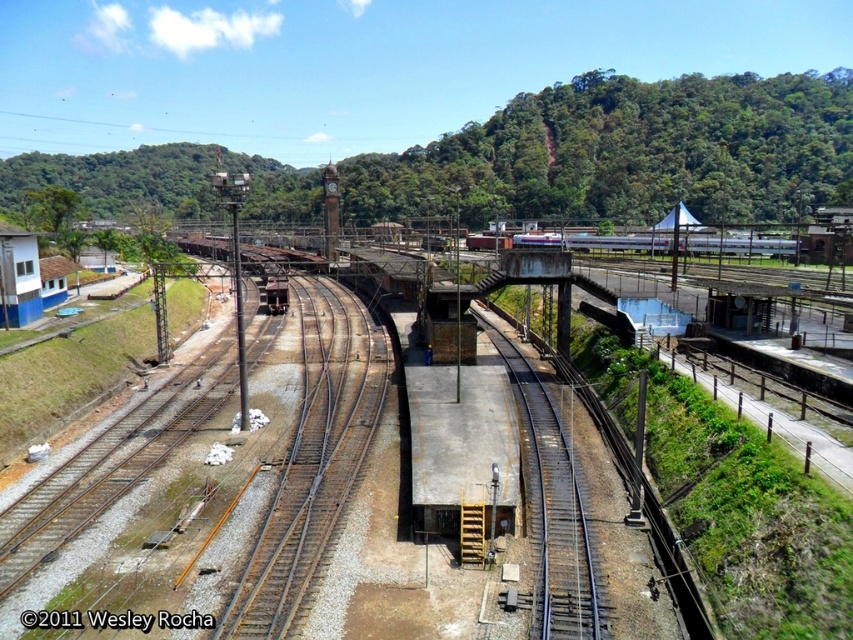
Looking at this image, you are a maintenance worker needing to check the height clearance for a new overhead bridge. Considering the smooth steel tracks at center and the silver metallic train at center, which object has a lower height?

The smooth steel tracks at center has a lesser height compared to the silver metallic train at center, so the smooth steel tracks at center is lower in height.

You are standing at the railway station and want to take a photo of both the point at coordinates point (805, 106) and point (546, 548). Which point is closer to your camera when you take the photo?

Point (546, 548) is closer to the camera than point (805, 106) because the description states that point (805, 106) is further away from the camera.

You are a train engineer approaching the station and need to stop the train before reaching the tracks. Given the distance between the green leafy hillside at upper center and the smooth steel tracks at center, can you safely stop the train within that distance?

The green leafy hillside at upper center is 257.28 meters away from the smooth steel tracks at center. If the train can stop within that distance, then it is safe. However, the stopping distance depends on factors like speed and braking efficiency, which are not provided here. Without that information, we cannot confirm safety.